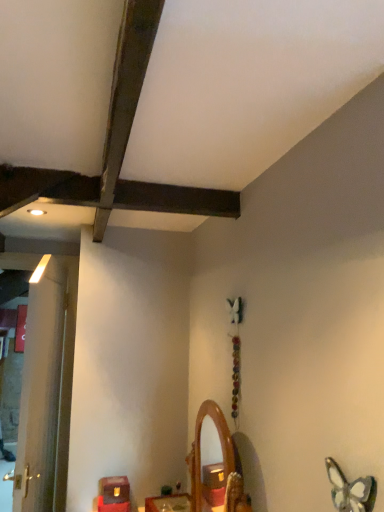
Question: Is wooden mirror at center, the second furniture when ordered from left to right, taller or shorter than wooden mirror at center?

Choices:
 (A) short
 (B) tall

Answer: (A)

Question: From the image's perspective, is wooden mirror at center, the second furniture when ordered from left to right, located above or below wooden mirror at center?

Choices:
 (A) below
 (B) above

Answer: (A)

Question: Which object is positioned closest to the white wood door at left?

Choices:
 (A) matte brown wooden box at lower left, the 1th furniture from the left
 (B) translucent glass butterfly at lower right
 (C) wooden mirror at center, the second furniture when ordered from left to right
 (D) wooden mirror at center

Answer: (A)

Question: Estimate the real-world distances between objects in this image. Which object is farther from the translucent glass butterfly at lower right?

Choices:
 (A) wooden mirror at center
 (B) matte brown wooden box at lower left, the second furniture in the right-to-left sequence
 (C) white wood door at left
 (D) wooden mirror at center, positioned as the first furniture in right-to-left order

Answer: (C)